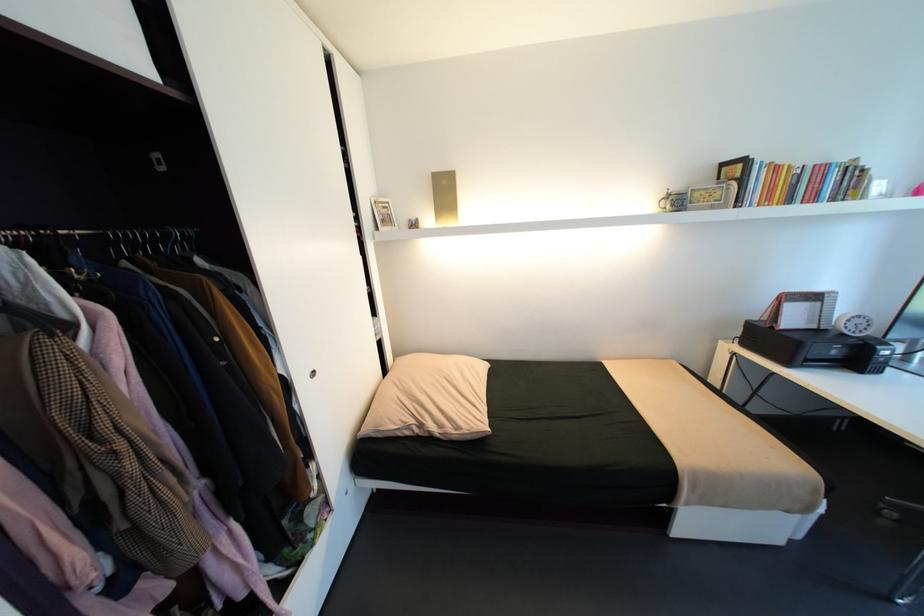
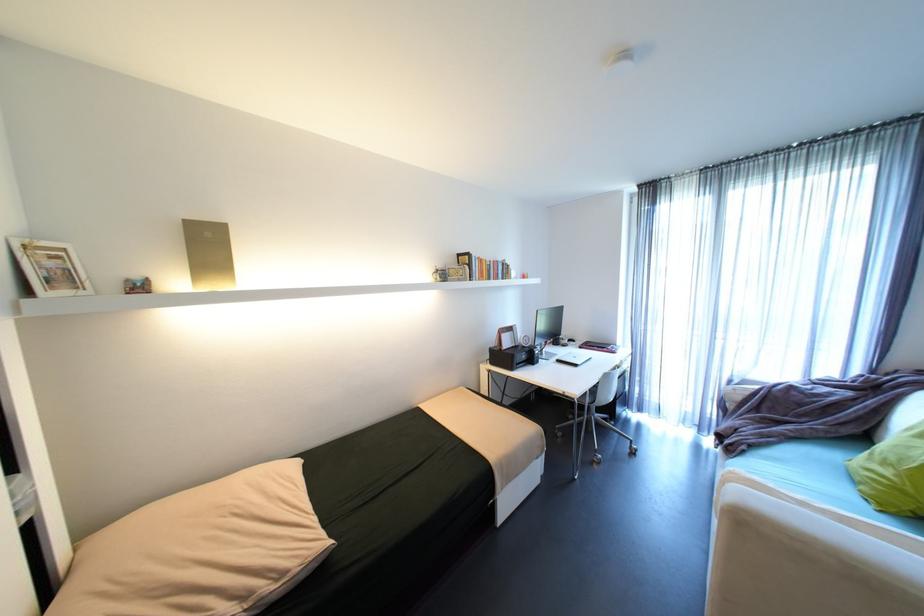
The point at (x=675, y=190) is marked in the first image. Where is the corresponding point in the second image?

(444, 267)